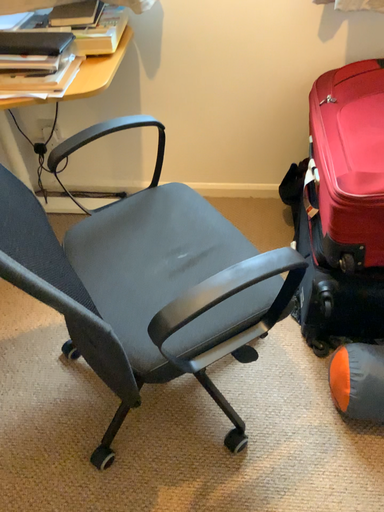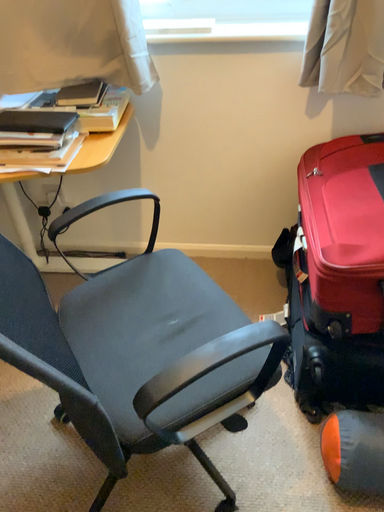
Question: How did the camera likely rotate when shooting the video?

Choices:
 (A) rotated upward
 (B) rotated downward

Answer: (A)